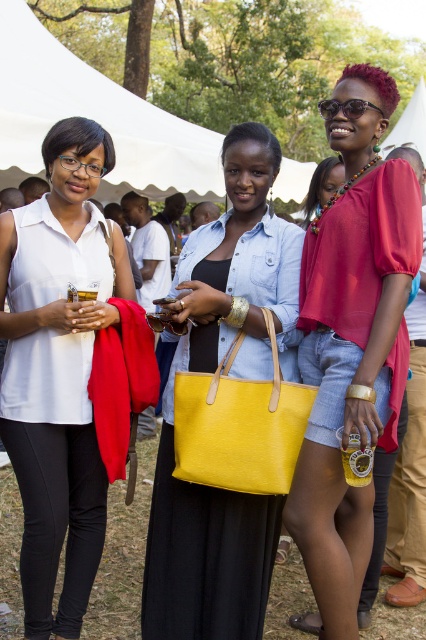
Can you confirm if white fabric canopy at upper center is smaller than yellow leather tote at center?

No.

Which is in front, point (22, 160) or point (265, 481)?

Point (265, 481) is more forward.

The height and width of the screenshot is (640, 426). Identify the location of white fabric canopy at upper center. (94, 118).

Can you confirm if matte red blouse at center is positioned above matte yellow tote bag at center?

Yes.

Can you confirm if matte red blouse at center is positioned to the right of matte yellow tote bag at center?

Indeed, matte red blouse at center is positioned on the right side of matte yellow tote bag at center.

Which is in front, point (347, 310) or point (259, 541)?

Positioned in front is point (347, 310).

Identify the location of matte red blouse at center. (353, 339).

Who is more distant from viewer, (405,362) or (264,436)?

Point (405,362)

Who is higher up, matte red blouse at center or yellow leather tote at center?

Positioned higher is matte red blouse at center.

Is point (405, 340) farther from camera compared to point (259, 380)?

Yes, point (405, 340) is behind point (259, 380).

Where is `matte red blouse at center`? The height and width of the screenshot is (640, 426). matte red blouse at center is located at coordinates (353, 339).